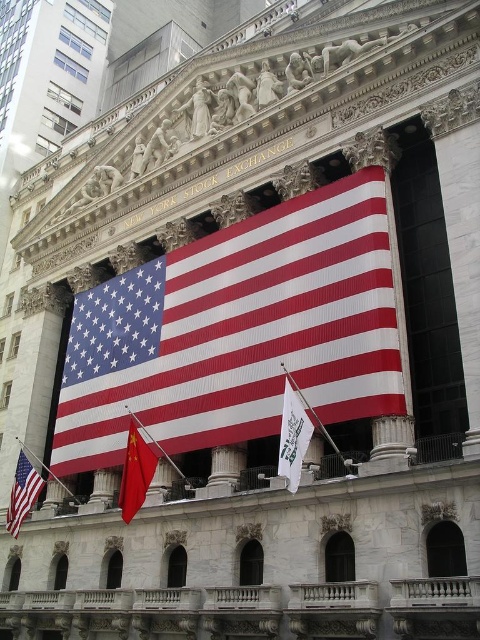
Based on the photo, you are an architect visiting the NYSE building and notice two flags displayed on its facade. The red fabric flag at center and the matte fabric flag at lower left. Which flag has a greater width?

The red fabric flag at center has a greater width than the matte fabric flag at lower left.

You are an architect analyzing the NYSE building facade. You notice two red fabric flags displayed on the facade. Which flag has a greater width between the red fabric flag at center and the red fabric flag at lower center?

The red fabric flag at center has a greater width than the red fabric flag at lower center according to the description.